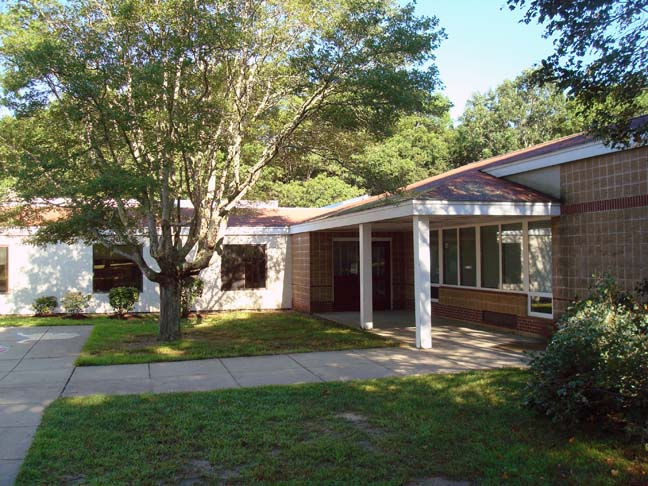
At what (x,y) coordinates should I click in order to perform the action: click on white wall. Please return your answer as a coordinate pair (x, y). Looking at the image, I should click on (273, 285), (50, 273).